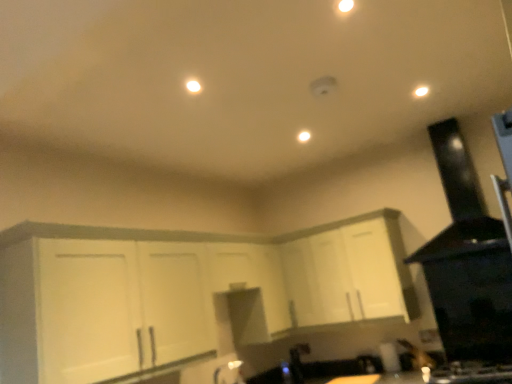
Question: Is there a large distance between black matte exhaust hood at upper right and white matte cabinet at center, the 2th cabinetry viewed from the right?

Choices:
 (A) yes
 (B) no

Answer: (A)

Question: From a real-world perspective, is black matte exhaust hood at upper right beneath white matte cabinet at center, acting as the first cabinetry starting from the left?

Choices:
 (A) no
 (B) yes

Answer: (A)

Question: Is black matte exhaust hood at upper right beside white matte cabinet at center, the 2th cabinetry viewed from the right?

Choices:
 (A) yes
 (B) no

Answer: (B)

Question: Considering the relative sizes of black matte exhaust hood at upper right and white matte cabinet at center, the 2th cabinetry viewed from the right, in the image provided, is black matte exhaust hood at upper right bigger than white matte cabinet at center, the 2th cabinetry viewed from the right,?

Choices:
 (A) no
 (B) yes

Answer: (A)

Question: Can you confirm if black matte exhaust hood at upper right is thinner than white matte cabinet at center, the 2th cabinetry viewed from the right?

Choices:
 (A) no
 (B) yes

Answer: (A)

Question: From a real-world perspective, relative to black glossy gas stove at lower right, is white glossy light at upper right, which appears as the first light when viewed from the front, vertically above or below?

Choices:
 (A) above
 (B) below

Answer: (A)

Question: In terms of size, does white glossy light at upper right, placed as the second light when sorted from back to front, appear bigger or smaller than black glossy gas stove at lower right?

Choices:
 (A) big
 (B) small

Answer: (B)

Question: Considering the positions of white glossy light at upper right, which ranks as the 1th light in right-to-left order, and black glossy gas stove at lower right in the image, is white glossy light at upper right, which ranks as the 1th light in right-to-left order, wider or thinner than black glossy gas stove at lower right?

Choices:
 (A) thin
 (B) wide

Answer: (A)

Question: Is point (415, 89) closer or farther from the camera than point (506, 379)?

Choices:
 (A) closer
 (B) farther

Answer: (A)

Question: Based on their sizes in the image, would you say white matte cabinet at center, the first cabinetry viewed from the right, is bigger or smaller than white glossy light at upper right, which appears as the first light when viewed from the front?

Choices:
 (A) small
 (B) big

Answer: (B)

Question: From the image's perspective, is white matte cabinet at center, which ranks as the 2th cabinetry in left-to-right order, above or below white glossy light at upper right, which appears as the first light when viewed from the front?

Choices:
 (A) above
 (B) below

Answer: (B)

Question: Visually, is white matte cabinet at center, which ranks as the 2th cabinetry in left-to-right order, positioned to the left or to the right of white glossy light at upper right, marked as the second light in a bottom-to-top arrangement?

Choices:
 (A) right
 (B) left

Answer: (B)

Question: Is white matte cabinet at center, which ranks as the 2th cabinetry in left-to-right order, situated inside white glossy light at upper right, which ranks as the 1th light in right-to-left order, or outside?

Choices:
 (A) outside
 (B) inside

Answer: (A)

Question: Based on their sizes in the image, would you say black matte exhaust hood at upper right is bigger or smaller than white matte cabinet at center, the first cabinetry viewed from the right?

Choices:
 (A) small
 (B) big

Answer: (B)

Question: In terms of width, does black matte exhaust hood at upper right look wider or thinner when compared to white matte cabinet at center, the first cabinetry viewed from the right?

Choices:
 (A) wide
 (B) thin

Answer: (A)